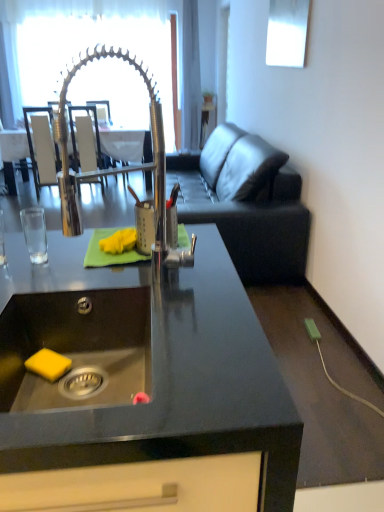
Identify the location of vacant region to the left of polished chrome tap at center. The height and width of the screenshot is (512, 384). (x=54, y=273).